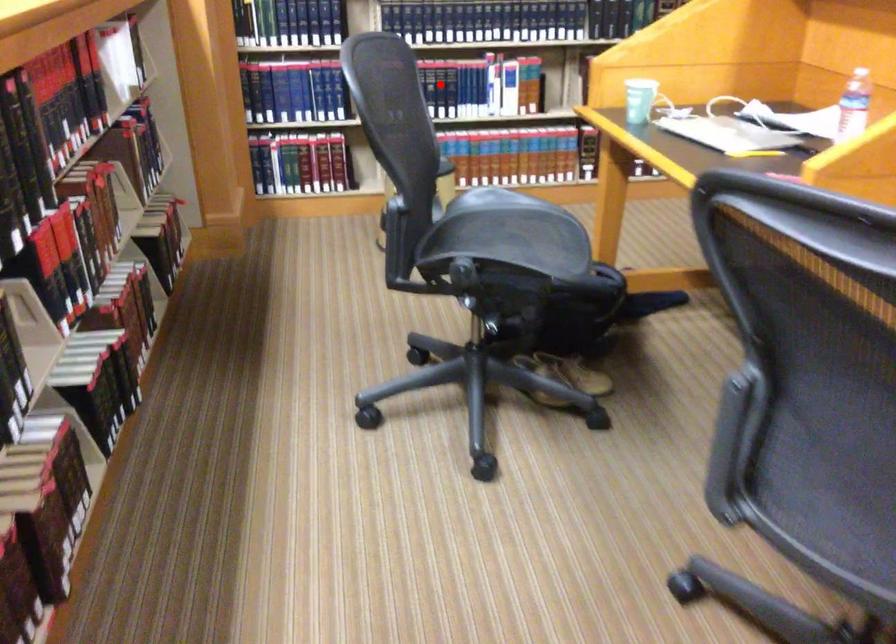
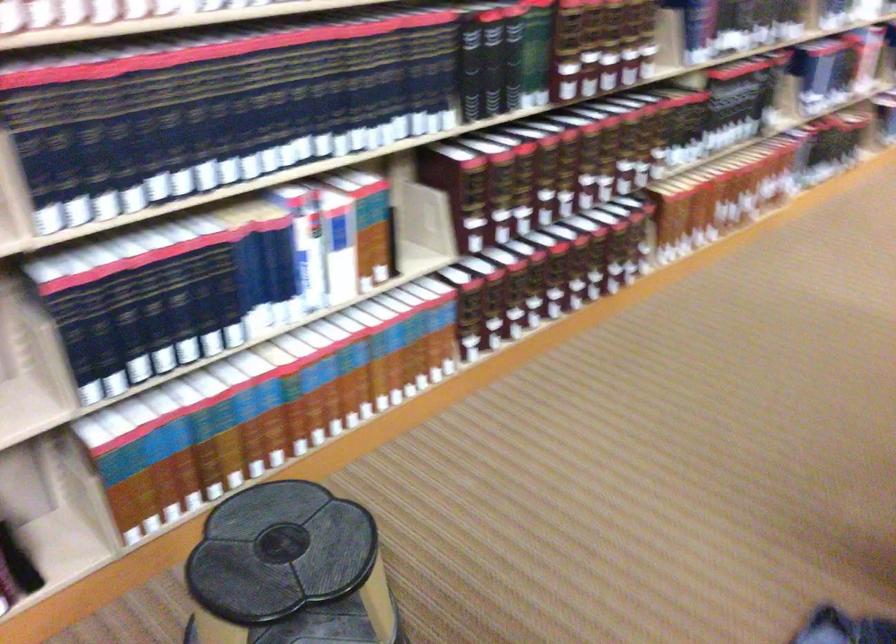
The point at the highlighted location is marked in the first image. Where is the corresponding point in the second image?

(200, 290)